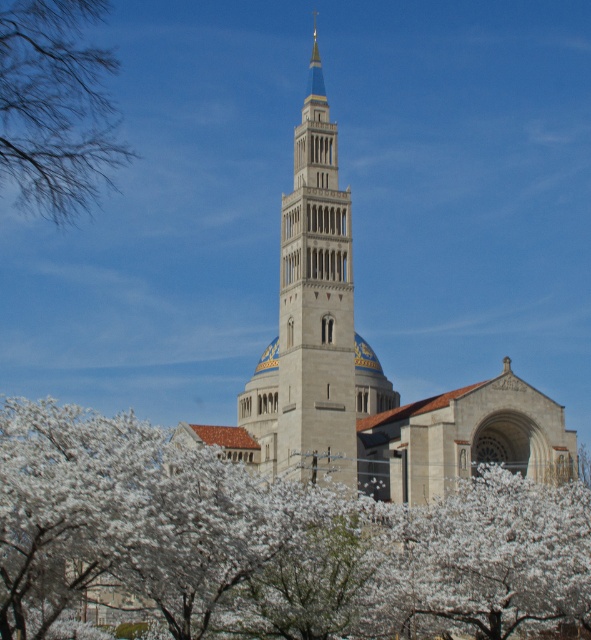
Who is more distant from viewer, (163, 460) or (330, 408)?

The point (330, 408) is more distant.

Where is `white blossoms at center`? The image size is (591, 640). white blossoms at center is located at coordinates (272, 541).

Image resolution: width=591 pixels, height=640 pixels. Find the location of `white blossoms at center`. white blossoms at center is located at coordinates (272, 541).

Does beige stone church at center appear on the right side of bare branches at upper left?

Yes, beige stone church at center is to the right of bare branches at upper left.

Which is in front, point (350, 285) or point (40, 163)?

Point (40, 163) is more forward.

Identify the location of beige stone church at center. (365, 369).

Which is more to the right, white blossoms at center or bare branches at upper left?

white blossoms at center is more to the right.

Between white blossoms at center and bare branches at upper left, which one has less height?

bare branches at upper left is shorter.

Is point (285, 556) farther from camera compared to point (76, 74)?

No, it is not.

The width and height of the screenshot is (591, 640). What are the coordinates of `white blossoms at center` in the screenshot? It's located at (272, 541).